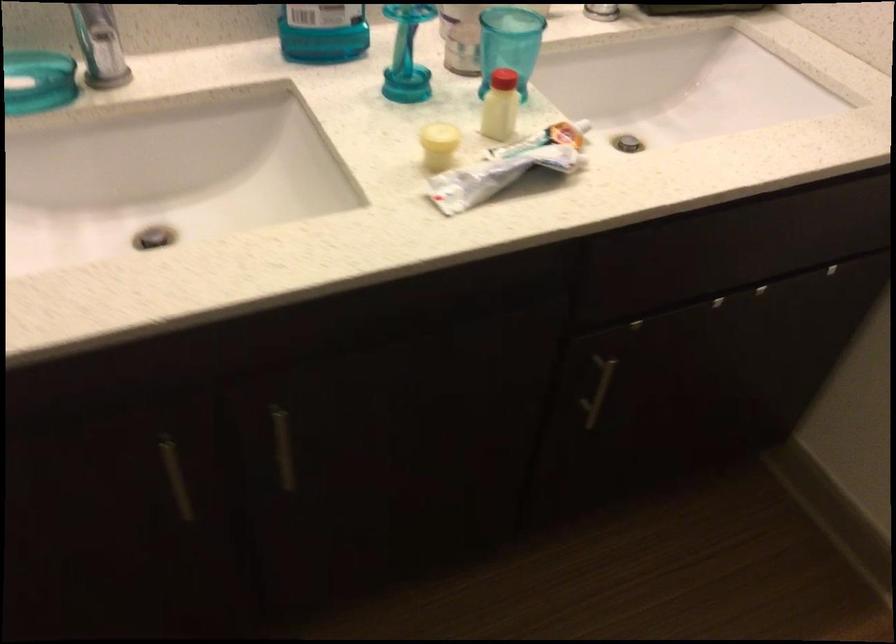
Find the location of `toothpaste tube`. toothpaste tube is located at coordinates (495, 176).